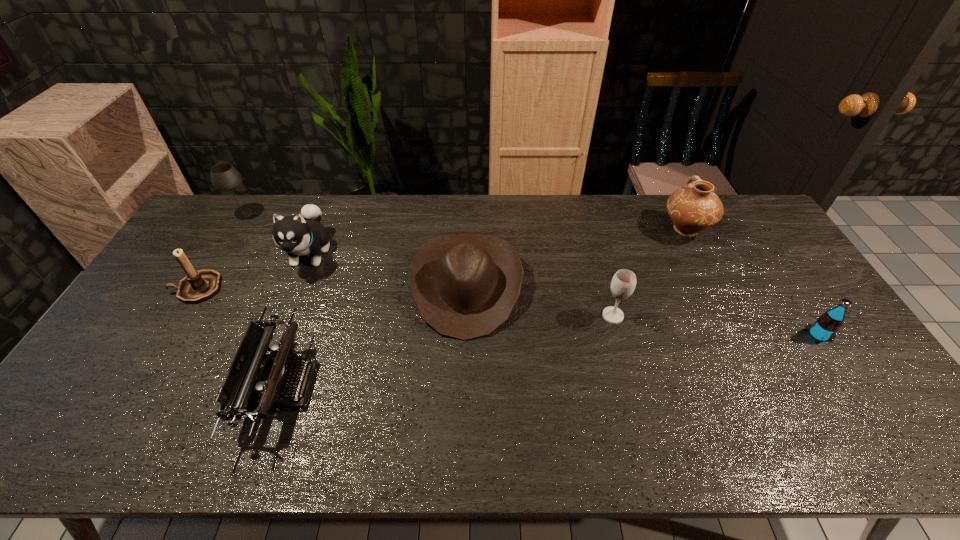
Where is `blank area located on the right of the left wineglass`? The width and height of the screenshot is (960, 540). blank area located on the right of the left wineglass is located at coordinates (357, 213).

Identify the location of vacant space located on the side of the seventh object from left to right with the handle. (671, 201).

This screenshot has height=540, width=960. What are the coordinates of `vacant space located on the left of the right wineglass` in the screenshot? It's located at (564, 316).

Locate an element on the screen. Image resolution: width=960 pixels, height=540 pixels. vacant space situated on the front of the candle holder is located at coordinates tap(147, 371).

The height and width of the screenshot is (540, 960). Identify the location of free space located 0.110m on the front of the fifth object from left to right. (464, 376).

Find the location of a particular element. free space located on the back of the rightmost object is located at coordinates (793, 297).

You are a GUI agent. You are given a task and a screenshot of the screen. Output one action in this format:
    pyautogui.click(x=<x>, y=<y>)
    Task: Click on the vacant space situated 0.330m on the typing side of the typewriter
    This screenshot has height=540, width=960.
    Given the screenshot: What is the action you would take?
    pyautogui.click(x=443, y=385)

At what (x,y) coordinates should I click in order to perform the action: click on puppy present at the far edge. Please return your answer as a coordinate pair (x, y). Looking at the image, I should click on coord(303,234).

Find the location of `wineglass situated at the far edge`. wineglass situated at the far edge is located at coordinates (224, 177).

Find the location of a particular element. pottery positioned at the far edge is located at coordinates (694, 208).